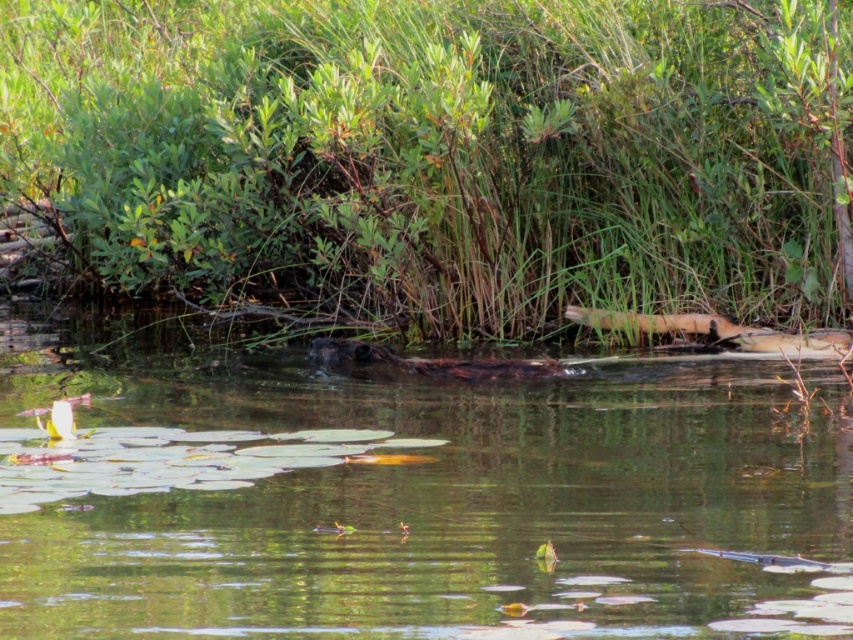
You are standing at the point labeled point (498, 35) and want to reach the point labeled point (253, 504). Which direction should you move to get closer to your destination?

You should move forward because point (498, 35) is behind point (253, 504), so moving forward from point (498, 35) will bring you closer to point (253, 504).